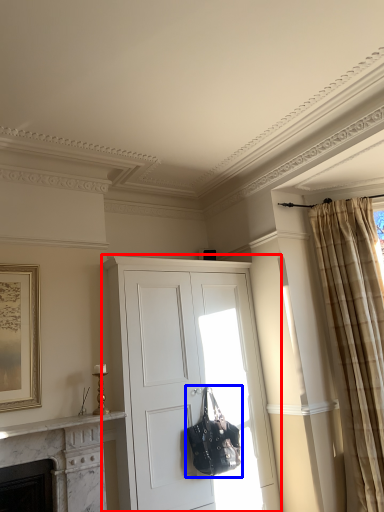
Question: Which object appears closest to the camera in this image, cabinetry (highlighted by a red box) or handbag (highlighted by a blue box)?

Choices:
 (A) cabinetry
 (B) handbag

Answer: (A)